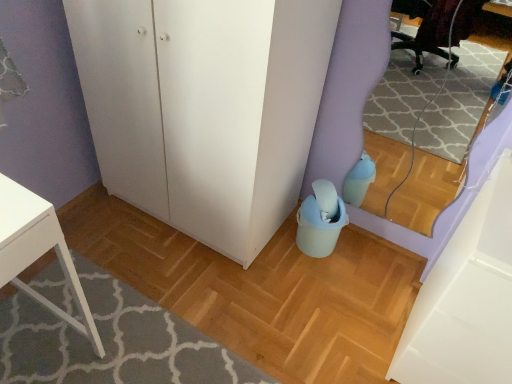
Question: From a real-world perspective, is white matte cabinet at lower right located beneath matte plastic bucket at lower center?

Choices:
 (A) yes
 (B) no

Answer: (B)

Question: From a real-world perspective, does white matte cabinet at lower right stand above matte plastic bucket at lower center?

Choices:
 (A) yes
 (B) no

Answer: (A)

Question: Would you say white matte cabinet at lower right is a long distance from matte plastic bucket at lower center?

Choices:
 (A) yes
 (B) no

Answer: (B)

Question: Can you confirm if white matte cabinet at lower right is positioned to the right of matte plastic bucket at lower center?

Choices:
 (A) yes
 (B) no

Answer: (A)

Question: Does white matte cabinet at lower right have a lesser width compared to matte plastic bucket at lower center?

Choices:
 (A) no
 (B) yes

Answer: (B)

Question: Can you confirm if white matte cabinet at lower right is taller than matte plastic bucket at lower center?

Choices:
 (A) no
 (B) yes

Answer: (B)

Question: Considering the relative positions of matte plastic bucket at lower center and white matte cabinet at lower right in the image provided, is matte plastic bucket at lower center to the left of white matte cabinet at lower right from the viewer's perspective?

Choices:
 (A) yes
 (B) no

Answer: (A)

Question: Could white matte cabinet at lower right be considered to be inside matte plastic bucket at lower center?

Choices:
 (A) no
 (B) yes

Answer: (A)

Question: Is the depth of matte plastic bucket at lower center greater than that of white matte cabinet at lower right?

Choices:
 (A) yes
 (B) no

Answer: (A)

Question: Is matte plastic bucket at lower center positioned with its back to white matte cabinet at lower right?

Choices:
 (A) no
 (B) yes

Answer: (A)

Question: Is matte plastic bucket at lower center closer to the viewer compared to white matte cabinet at lower right?

Choices:
 (A) yes
 (B) no

Answer: (B)

Question: Can you confirm if matte plastic bucket at lower center is taller than white matte cabinet at lower right?

Choices:
 (A) yes
 (B) no

Answer: (B)

Question: Can you confirm if matte plastic bucket at lower center is taller than white matte cabinet at lower right?

Choices:
 (A) no
 (B) yes

Answer: (A)